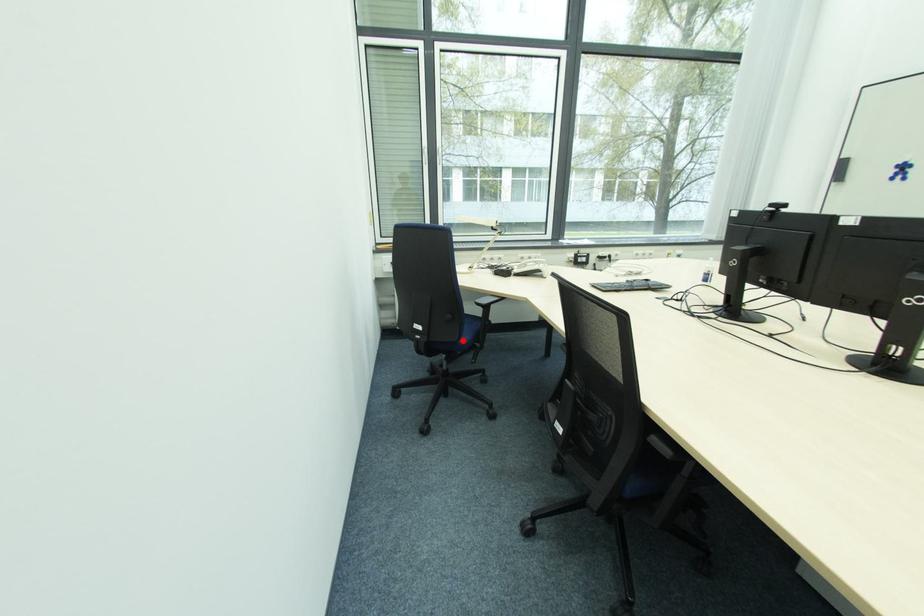
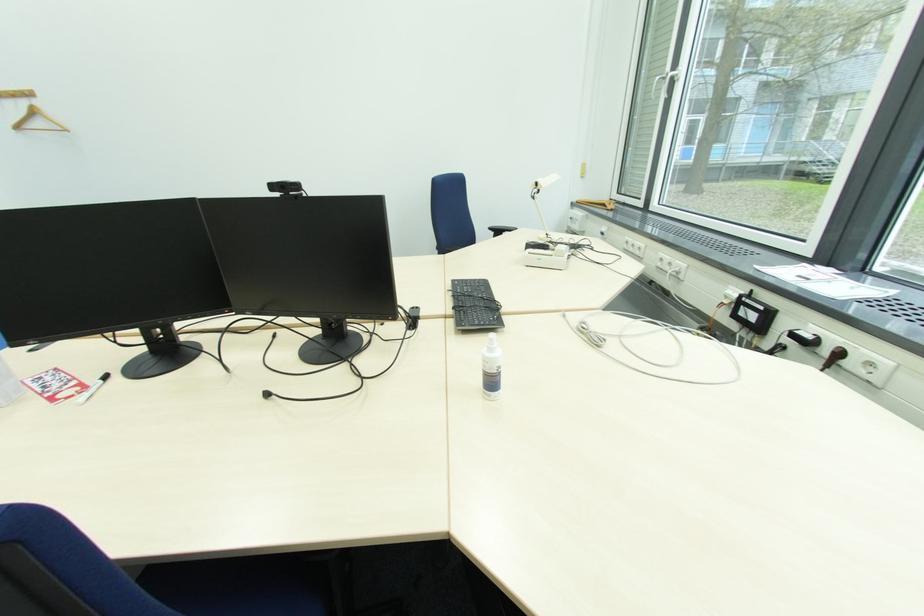
Question: I am providing you with two images of the same scene from different viewpoints. A red point is marked on the first image. Is the red point's position out of view in image 2?

Choices:
 (A) Yes
 (B) No

Answer: (A)